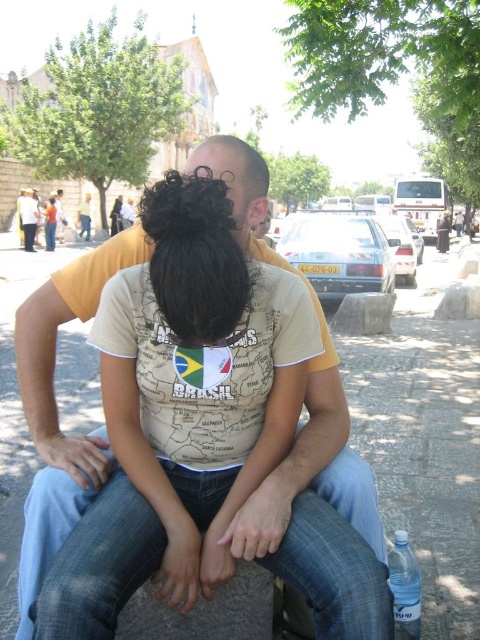
Which is more to the left, yellow cotton shirt at center or transparent plastic bottle at lower right?

Positioned to the left is yellow cotton shirt at center.

Between point (279, 540) and point (419, 628), which one is positioned in front?

Point (279, 540)

You are a GUI agent. You are given a task and a screenshot of the screen. Output one action in this format:
    pyautogui.click(x=<x>, y=<y>)
    Task: Click on the yellow cotton shirt at center
    This screenshot has height=640, width=480.
    Given the screenshot: What is the action you would take?
    pyautogui.click(x=304, y=396)

Who is more forward, (419, 612) or (34, 195)?

A: Point (419, 612) is in front.

Who is more distant from viewer, (x=406, y=540) or (x=43, y=212)?

Positioned behind is point (x=43, y=212).

Locate an element on the screen. The image size is (480, 640). transparent plastic bottle at lower right is located at coordinates (405, 588).

Who is positioned more to the right, yellow cotton shirt at center or white cotton shirt at center?

From the viewer's perspective, yellow cotton shirt at center appears more on the right side.

Which is below, yellow cotton shirt at center or white cotton shirt at center?

yellow cotton shirt at center is lower down.

Who is more forward, (230, 196) or (49, 225)?

Point (230, 196) is more forward.

Locate an element on the screen. This screenshot has width=480, height=640. yellow cotton shirt at center is located at coordinates (304, 396).